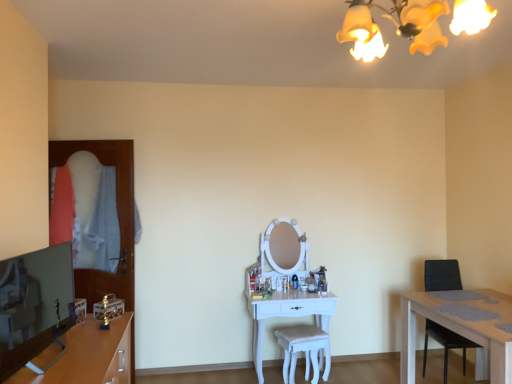
Question: From the image's perspective, is black leather chair at right on top of white fabric stool at center?

Choices:
 (A) no
 (B) yes

Answer: (B)

Question: Is black leather chair at right positioned in front of white fabric stool at center?

Choices:
 (A) no
 (B) yes

Answer: (B)

Question: Can you confirm if black leather chair at right is taller than white fabric stool at center?

Choices:
 (A) yes
 (B) no

Answer: (A)

Question: Does black leather chair at right have a smaller size compared to white fabric stool at center?

Choices:
 (A) yes
 (B) no

Answer: (B)

Question: Considering the relative sizes of black leather chair at right and white fabric stool at center in the image provided, is black leather chair at right thinner than white fabric stool at center?

Choices:
 (A) yes
 (B) no

Answer: (B)

Question: From the image's perspective, is black leather chair at right positioned above or below white fabric stool at center?

Choices:
 (A) below
 (B) above

Answer: (B)

Question: Is black leather chair at right to the left or to the right of white fabric stool at center in the image?

Choices:
 (A) right
 (B) left

Answer: (A)

Question: Based on their sizes in the image, would you say black leather chair at right is bigger or smaller than white fabric stool at center?

Choices:
 (A) small
 (B) big

Answer: (B)

Question: In terms of width, does black leather chair at right look wider or thinner when compared to white fabric stool at center?

Choices:
 (A) wide
 (B) thin

Answer: (A)

Question: Is black leather chair at right in front of or behind yellow fabric lampshade at upper center in the image?

Choices:
 (A) front
 (B) behind

Answer: (B)

Question: Choose the correct answer: Is black leather chair at right inside yellow fabric lampshade at upper center or outside it?

Choices:
 (A) inside
 (B) outside

Answer: (B)

Question: Is point (431, 266) closer or farther from the camera than point (433, 13)?

Choices:
 (A) farther
 (B) closer

Answer: (A)

Question: Based on their sizes in the image, would you say black leather chair at right is bigger or smaller than yellow fabric lampshade at upper center?

Choices:
 (A) big
 (B) small

Answer: (A)

Question: From a real-world perspective, is white fabric stool at center physically located above or below white glossy vanity at center?

Choices:
 (A) above
 (B) below

Answer: (B)

Question: Looking at the image, does white fabric stool at center seem bigger or smaller compared to white glossy vanity at center?

Choices:
 (A) big
 (B) small

Answer: (B)